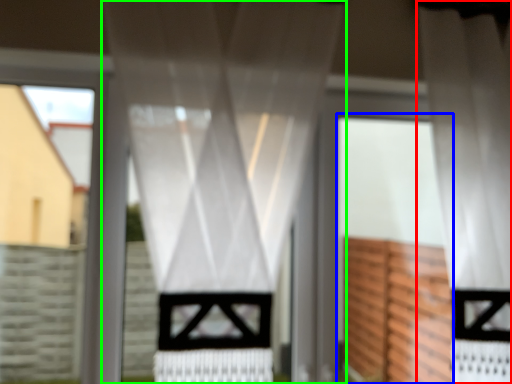
Question: Which object is the closest to the curtain (highlighted by a red box)? Choose among these: screen door (highlighted by a blue box) or curtain (highlighted by a green box).

Choices:
 (A) screen door
 (B) curtain

Answer: (A)